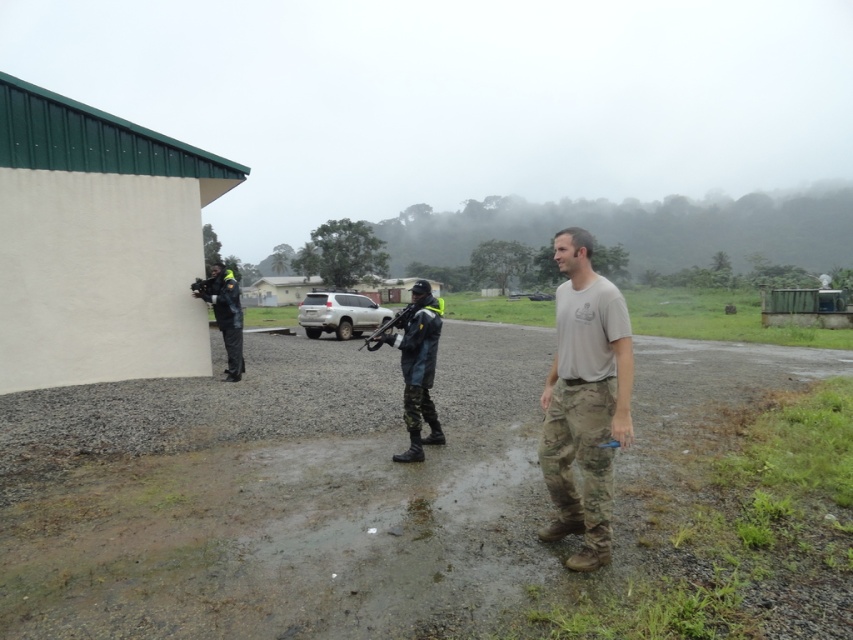
Can you confirm if wet gravel mud at center is taller than matte black rifle at center?

In fact, wet gravel mud at center may be shorter than matte black rifle at center.

Is wet gravel mud at center below matte black rifle at center?

Indeed, wet gravel mud at center is positioned under matte black rifle at center.

Measure the distance between wet gravel mud at center and camera.

A distance of 2.56 meters exists between wet gravel mud at center and camera.

The width and height of the screenshot is (853, 640). Identify the location of wet gravel mud at center. (332, 486).

Is wet gravel mud at center bigger than tan/camouflage pants at center?

Indeed, wet gravel mud at center has a larger size compared to tan/camouflage pants at center.

How much distance is there between wet gravel mud at center and tan/camouflage pants at center?

wet gravel mud at center is 5.01 meters away from tan/camouflage pants at center.

Between point (624, 513) and point (601, 285), which one is positioned in front?

Point (601, 285)

In order to click on wet gravel mud at center in this screenshot , I will do `click(332, 486)`.

Does wet gravel mud at center come in front of rubberized black jacket at left?

Yes, wet gravel mud at center is in front of rubberized black jacket at left.

Who is more distant from viewer, (368, 476) or (219, 300)?

Positioned behind is point (219, 300).

Does point (45, 621) come in front of point (235, 307)?

Yes.

Where is `wet gravel mud at center`? The image size is (853, 640). wet gravel mud at center is located at coordinates (332, 486).